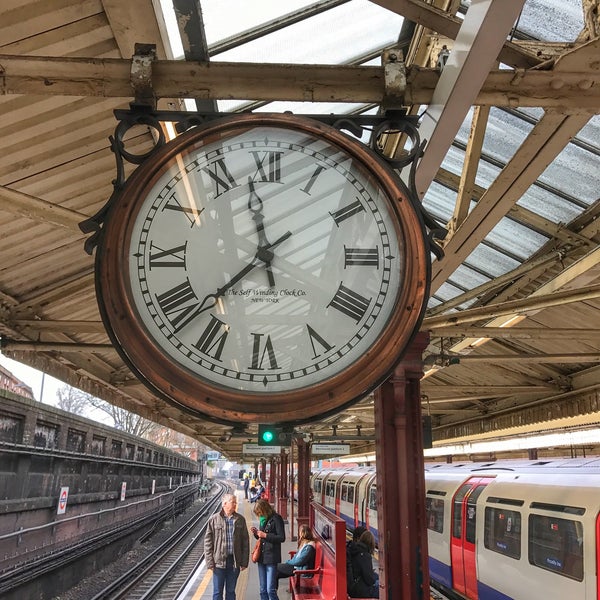
Find the location of a particular element. This screenshot has width=600, height=600. clock face is located at coordinates (290, 264).